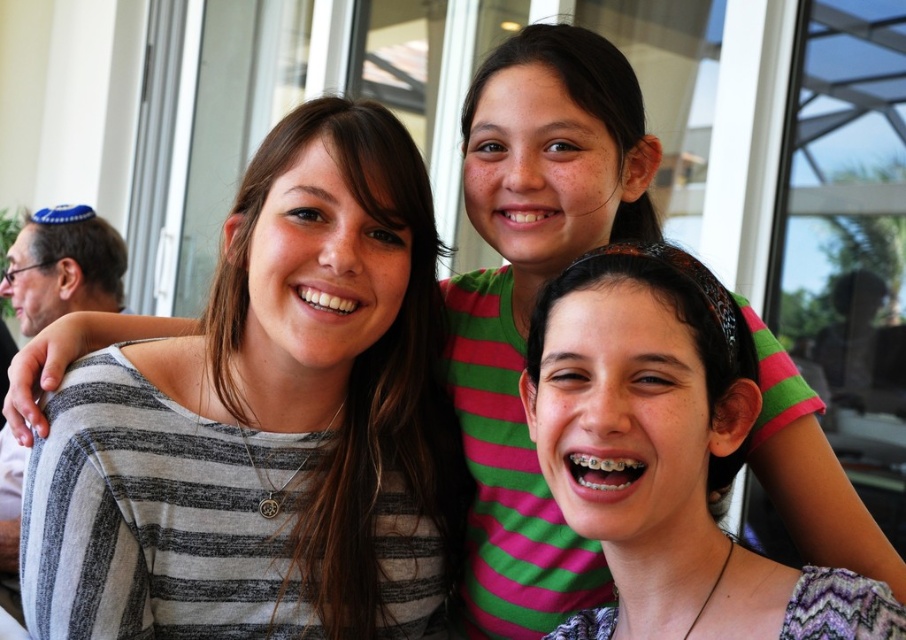
Question: Which point is closer to the camera taking this photo?

Choices:
 (A) (614, 252)
 (B) (99, 499)

Answer: (A)

Question: Which point is farther from the camera taking this photo?

Choices:
 (A) (217, 403)
 (B) (109, 291)
 (C) (747, 584)

Answer: (B)

Question: Can you confirm if gray striped shirt at upper left is bigger than multicolored woven headband at center?

Choices:
 (A) no
 (B) yes

Answer: (B)

Question: Is gray striped shirt at upper left closer to the viewer compared to multicolored woven headband at center?

Choices:
 (A) no
 (B) yes

Answer: (A)

Question: Can you confirm if multicolored woven headband at center is smaller than blue fabric kippah at upper left?

Choices:
 (A) no
 (B) yes

Answer: (B)

Question: Which point is closer to the camera?

Choices:
 (A) gray striped shirt at upper left
 (B) multicolored woven headband at center
 (C) blue fabric kippah at upper left

Answer: (B)